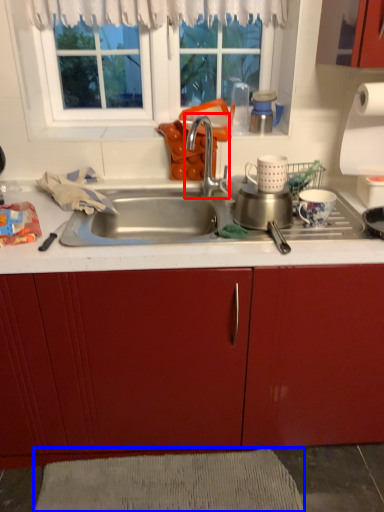
Question: Which object is closer to the camera taking this photo, tap (highlighted by a red box) or plain (highlighted by a blue box)?

Choices:
 (A) tap
 (B) plain

Answer: (A)